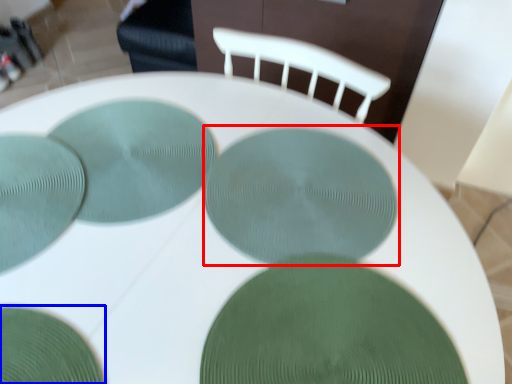
Question: Among these objects, which one is farthest to the camera, glass plate (highlighted by a red box) or glass plate (highlighted by a blue box)?

Choices:
 (A) glass plate
 (B) glass plate

Answer: (A)